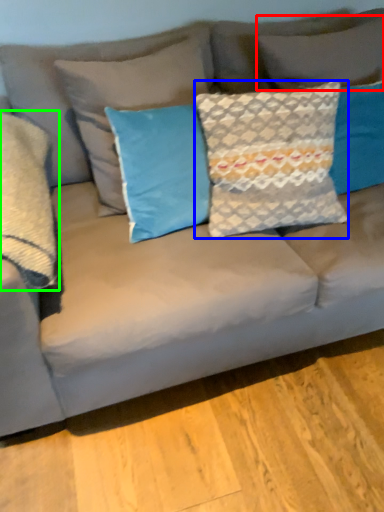
Question: Which object is positioned farthest from pillow (highlighted by a red box)? Select from pillow (highlighted by a blue box) and pillow (highlighted by a green box).

Choices:
 (A) pillow
 (B) pillow

Answer: (B)